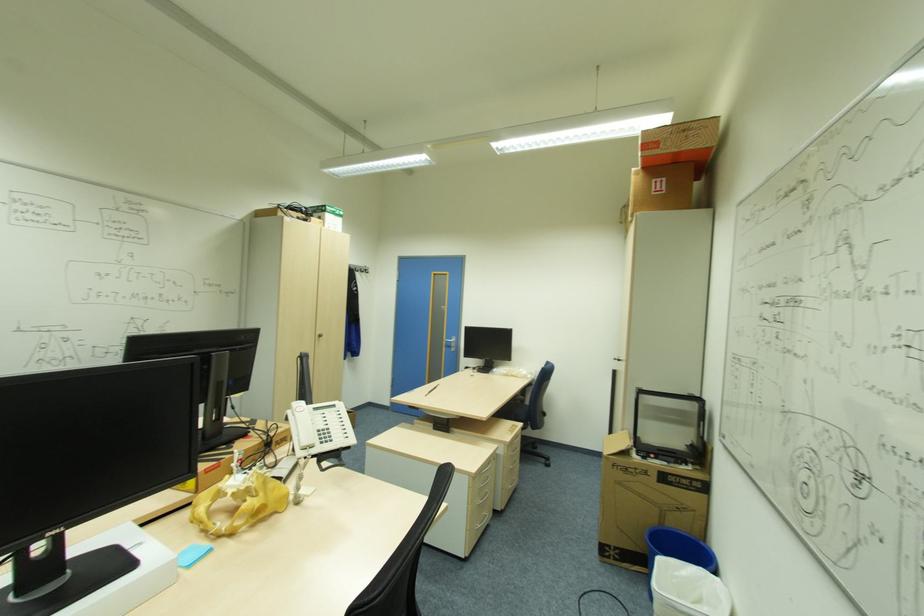
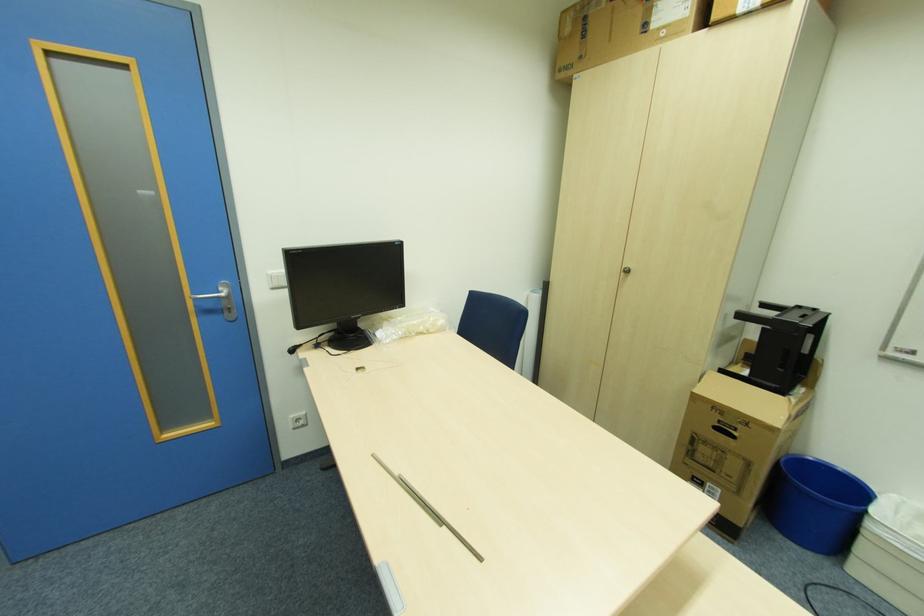
In the second image, find the point that corresponds to point 516,373 in the first image.

(424, 329)